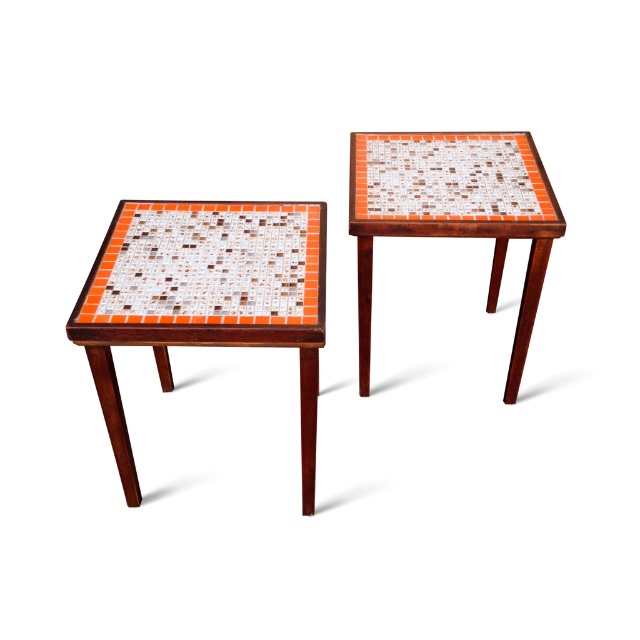
Question: Estimate the real-world distances between objects in this image. Which object is closer to the orange mosaic tile side table at upper right?

Choices:
 (A) mosaic tile table at left
 (B) orange mosaic tile at left

Answer: (B)

Question: Does orange mosaic tile at left appear on the right side of orange mosaic tile side table at upper right?

Choices:
 (A) no
 (B) yes

Answer: (A)

Question: Among these points, which one is nearest to the camera?

Choices:
 (A) (195, 340)
 (B) (166, 289)

Answer: (A)

Question: Can you confirm if mosaic tile table at left is positioned to the right of orange mosaic tile side table at upper right?

Choices:
 (A) yes
 (B) no

Answer: (B)

Question: Which object appears farthest from the camera in this image?

Choices:
 (A) orange mosaic tile side table at upper right
 (B) orange mosaic tile at left
 (C) mosaic tile table at left

Answer: (A)

Question: Where is mosaic tile table at left located in relation to orange mosaic tile side table at upper right in the image?

Choices:
 (A) right
 (B) left

Answer: (B)